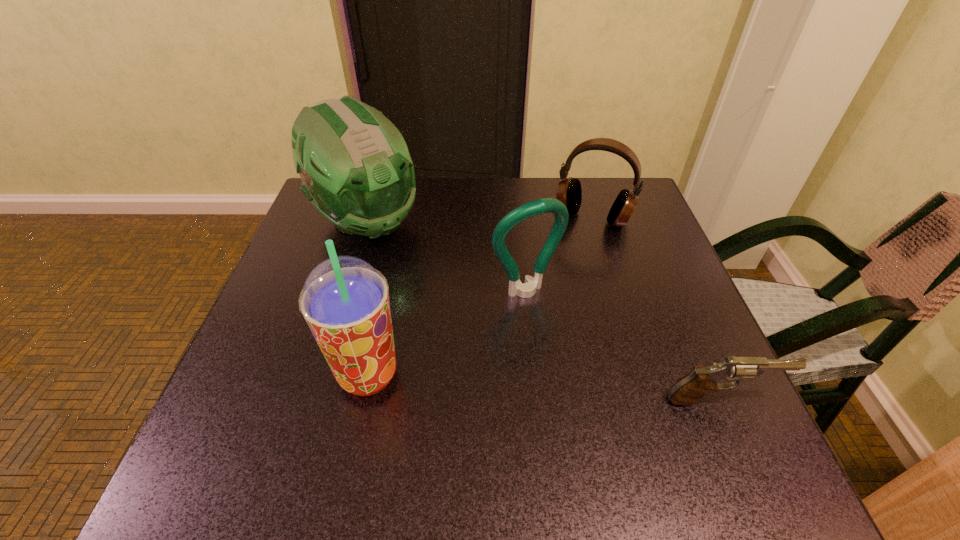
Where is `smoothie`? The image size is (960, 540). smoothie is located at coordinates (345, 301).

You are a GUI agent. You are given a task and a screenshot of the screen. Output one action in this format:
    pyautogui.click(x=<x>, y=<y>)
    Task: Click on the shortest object
    The image size is (960, 540).
    Given the screenshot: What is the action you would take?
    pyautogui.click(x=689, y=389)

Locate an element on the screen. football helmet is located at coordinates coord(356,170).

In order to click on the second shortest object in this screenshot , I will do `click(569, 192)`.

The width and height of the screenshot is (960, 540). I want to click on bottle opener, so click(546, 205).

Locate an element on the screen. The image size is (960, 540). the third object from right to left is located at coordinates (546, 205).

Find the location of a particular element. Image resolution: width=960 pixels, height=540 pixels. vacant space positioned on the back of the smoothie is located at coordinates (396, 241).

Identify the location of free location located on the visor of the football helmet. (436, 293).

Locate an element on the screen. The height and width of the screenshot is (540, 960). free location located 0.190m on the visor of the football helmet is located at coordinates (441, 298).

Where is `vacant space located 0.230m on the visor of the football helmet`? Image resolution: width=960 pixels, height=540 pixels. vacant space located 0.230m on the visor of the football helmet is located at coordinates (452, 308).